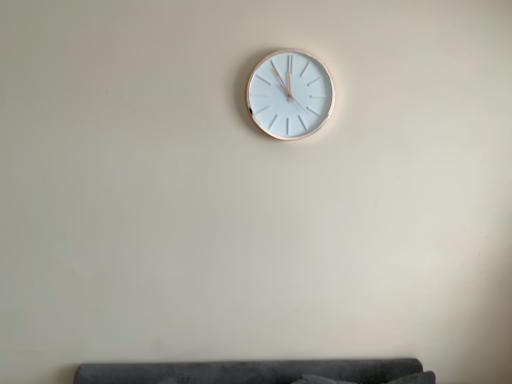
Describe the element at coordinates (290, 94) in the screenshot. I see `rose gold metallic clock at upper center` at that location.

Measure the distance between rose gold metallic clock at upper center and camera.

1.66 meters.

Measure the distance between point (313, 122) and camera.

They are 5.60 feet apart.

This screenshot has height=384, width=512. Identify the location of rose gold metallic clock at upper center. (290, 94).

At what (x,y) coordinates should I click in order to perform the action: click on rose gold metallic clock at upper center. Please return your answer as a coordinate pair (x, y). The width and height of the screenshot is (512, 384). Looking at the image, I should click on (290, 94).